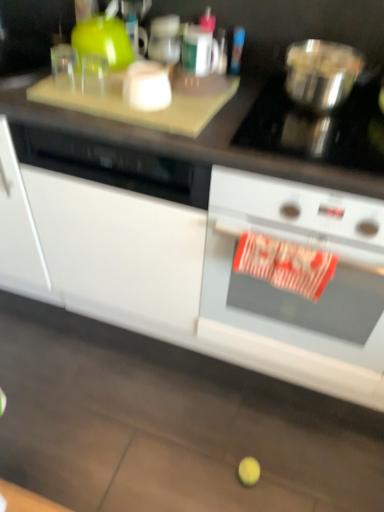
Question: Would you say white matte cabinet at lower center is to the left or to the right of white glossy oven at right in the picture?

Choices:
 (A) left
 (B) right

Answer: (A)

Question: Does point (99, 253) appear closer or farther from the camera than point (331, 234)?

Choices:
 (A) farther
 (B) closer

Answer: (A)

Question: Which object is the closest to the white matte cabinet at lower center?

Choices:
 (A) white glossy oven at right
 (B) metallic silver bowl at upper right

Answer: (A)

Question: Which object is positioned farthest from the white glossy oven at right?

Choices:
 (A) white matte cabinet at lower center
 (B) metallic silver bowl at upper right

Answer: (B)